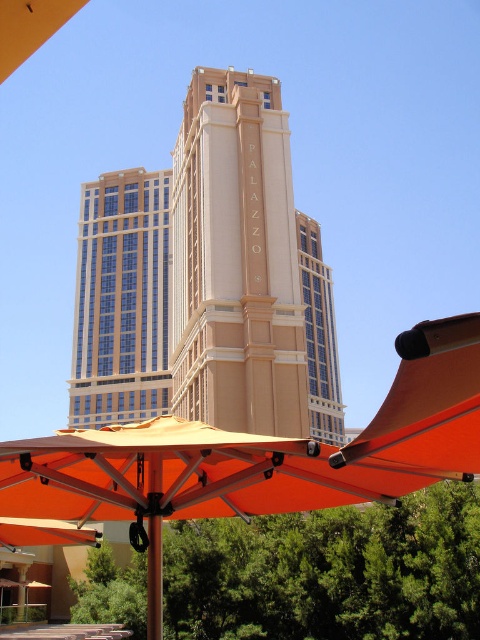
Is orange fabric umbrella at lower center closer to the viewer compared to beige stone tower at center?

That is True.

Is orange fabric umbrella at lower center behind beige stone tower at center?

No, orange fabric umbrella at lower center is closer to the viewer.

Which is behind, point (180, 492) or point (190, 186)?

The point (190, 186) is behind.

The image size is (480, 640). What are the coordinates of `orange fabric umbrella at lower center` in the screenshot? It's located at (259, 456).